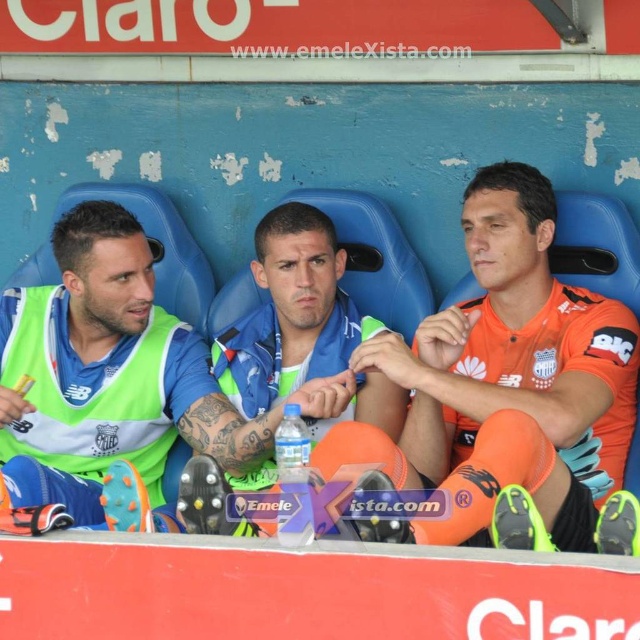
Question: Which object appears closest to the camera in this image?

Choices:
 (A) green fabric jersey at center
 (B) blue matte jersey at center
 (C) orange jersey at center

Answer: (C)

Question: Does orange jersey at center have a greater width compared to green fabric jersey at center?

Choices:
 (A) yes
 (B) no

Answer: (A)

Question: Is green fabric jersey at center below blue matte jersey at center?

Choices:
 (A) no
 (B) yes

Answer: (B)

Question: In this image, where is green fabric jersey at center located relative to blue matte jersey at center?

Choices:
 (A) above
 (B) below

Answer: (B)

Question: Which object is positioned closest to the orange jersey at center?

Choices:
 (A) blue matte jersey at center
 (B) green fabric jersey at center

Answer: (A)

Question: Which point is farther to the camera?

Choices:
 (A) (42, 486)
 (B) (384, 467)
 (C) (298, 260)

Answer: (C)